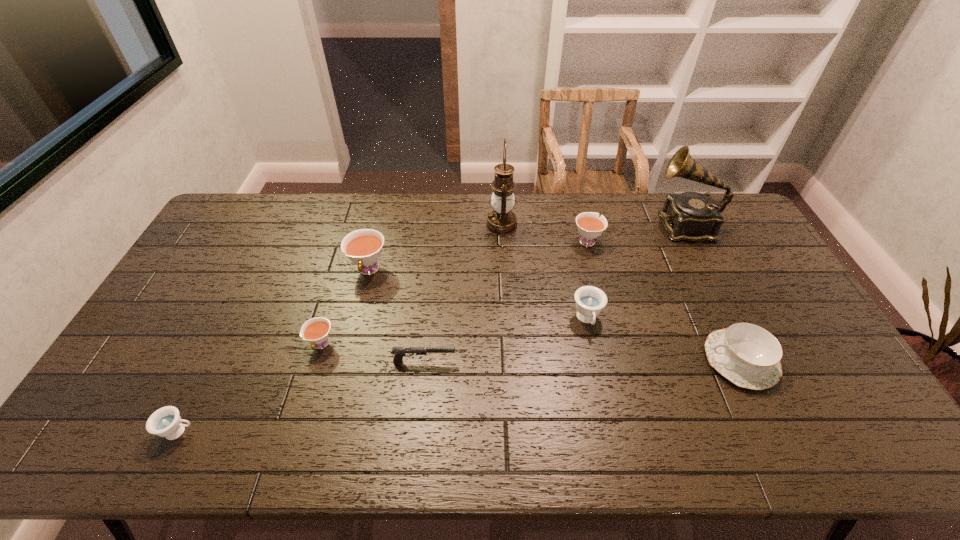
I want to click on vacant space that satisfies the following two spatial constraints: 1. on the horn of the phonograph record; 2. on the side of the second farthest teacup with the handle, so click(707, 270).